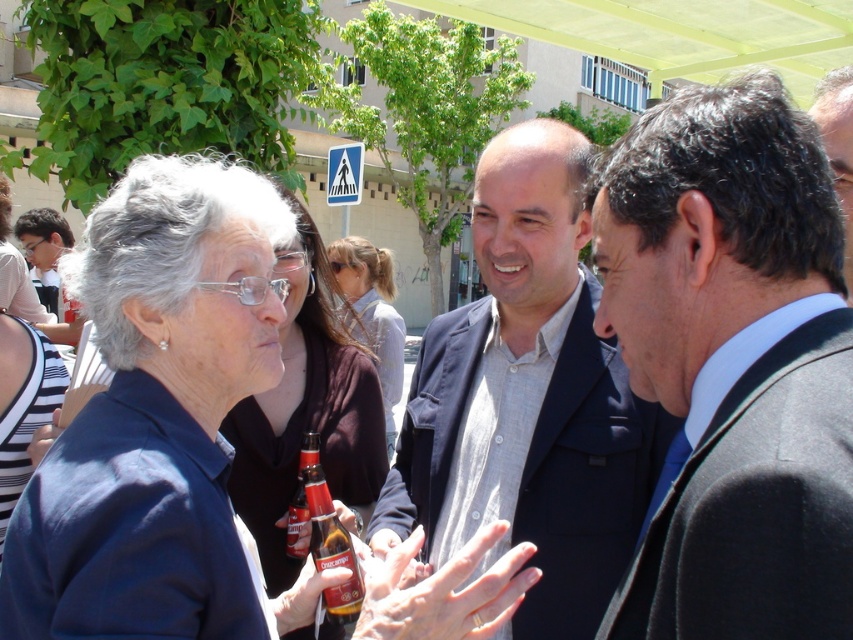
You are a photographer standing between the dark gray suit at center and the matte black jacket at center. You want to take a photo of both subjects without them overlapping. Given that your camera has a minimum focus distance of 4 feet, will you be able to capture both subjects clearly in the frame?

The distance between the dark gray suit at center and the matte black jacket at center is 3.95 feet, which is less than the camera minimum focus distance of 4 feet. Therefore, you cannot capture both subjects clearly without overlapping.

You are a photographer trying to capture a candid shot of the light brown hair at center without including the dark blue suit at center in the frame. Is this possible based on their current positions?

The dark blue suit at center is in front of the light brown hair at center, so it would block the view. Therefore, you cannot capture the light brown hair at center without including the dark blue suit at center in the frame.